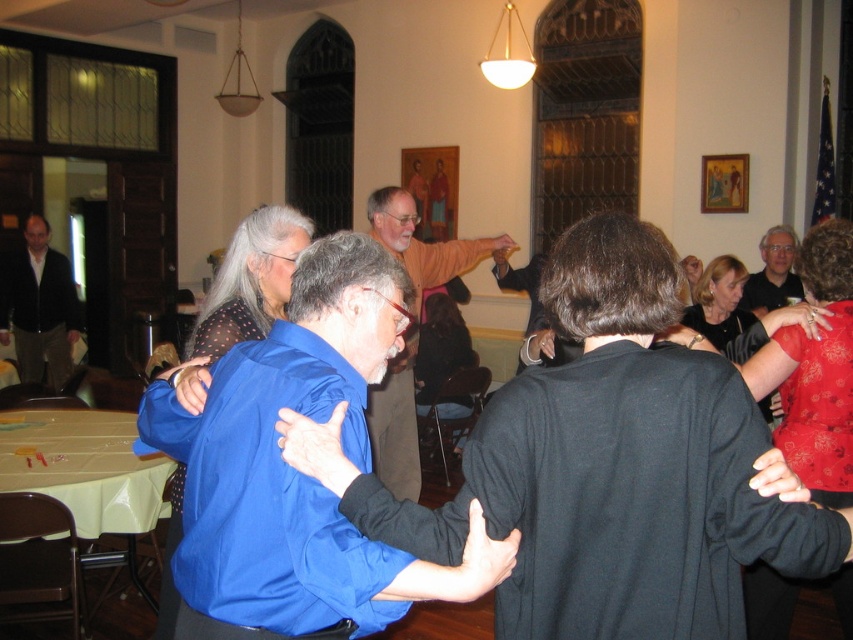
From the picture: You are at a social event and want to find the person wearing the orange cotton shirt at center. Which direction should you look relative to the person wearing the matte black shirt at upper right?

The orange cotton shirt at center is positioned on the left side of the matte black shirt at upper right, so you should look to the left relative to the matte black shirt at upper right.

You are at a social event and see two shirts hanging on a coat rack in the center of the room. The blue satin shirt at center and the orange cotton shirt at center. Which shirt is closer to the floor?

The blue satin shirt at center is positioned under the orange cotton shirt at center, so it is closer to the floor.